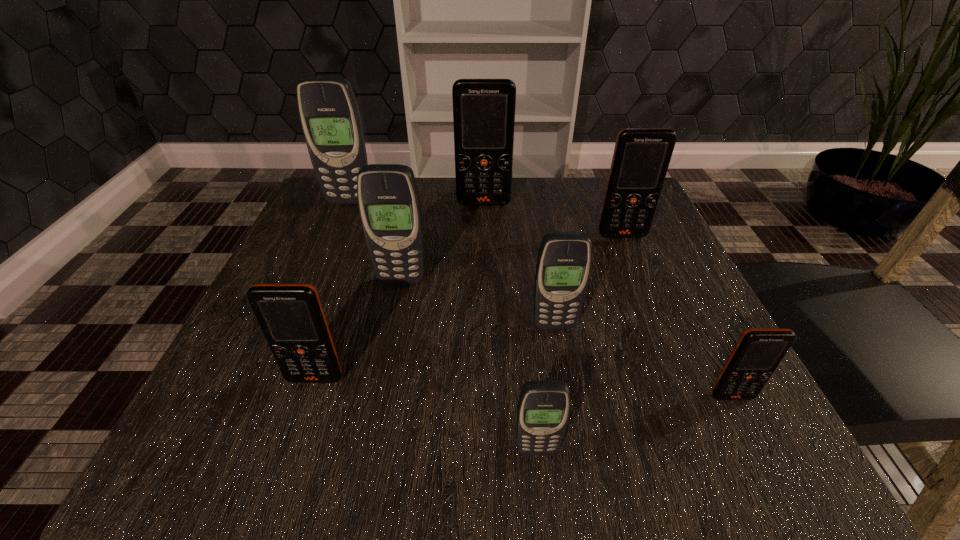
I want to click on vacant space situated on the screen of the third biggest gray cellular telephone, so click(569, 413).

Image resolution: width=960 pixels, height=540 pixels. In order to click on vacant region located 0.120m on the screen of the third nearest cellular telephone in this screenshot , I will do `click(285, 467)`.

Where is `object present at the near edge`? This screenshot has height=540, width=960. object present at the near edge is located at coordinates click(x=543, y=410).

Find the location of `object located at the far left corner`. object located at the far left corner is located at coordinates (329, 114).

Identify the location of object that is at the far right corner. This screenshot has height=540, width=960. click(641, 158).

You are a GUI agent. You are given a task and a screenshot of the screen. Output one action in this format:
    pyautogui.click(x=<x>, y=<y>)
    Task: Click on the vacant space at the far edge of the desktop
    This screenshot has width=960, height=540.
    Given the screenshot: What is the action you would take?
    pyautogui.click(x=437, y=202)

Identify the location of free region at the near edge of the desktop. The height and width of the screenshot is (540, 960). (458, 462).

This screenshot has width=960, height=540. What are the coordinates of `vacant space at the left edge of the desktop` in the screenshot? It's located at (276, 268).

What are the coordinates of `blank space at the right edge` in the screenshot? It's located at (650, 362).

Identify the location of vacant space at the far left corner of the desktop. (317, 198).